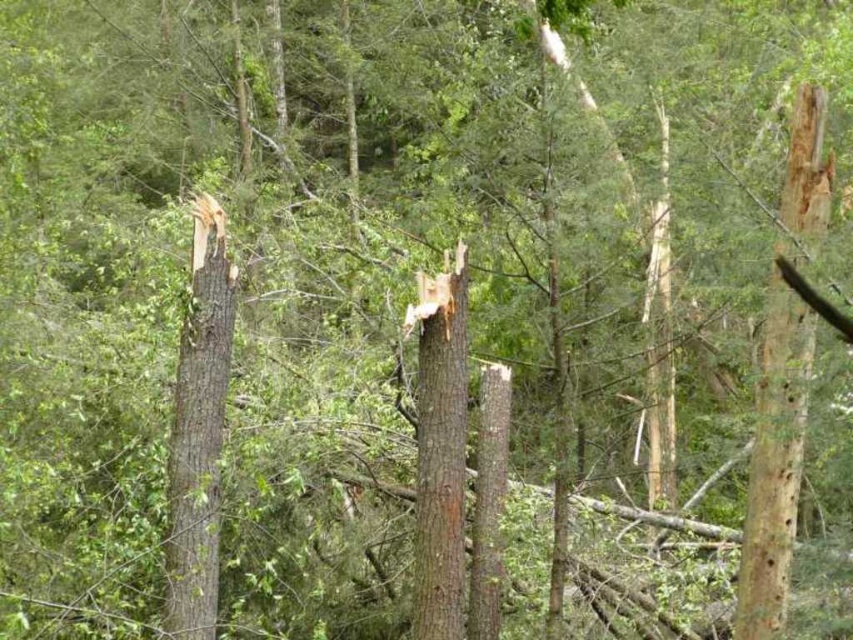
Question: Which point appears closest to the camera in this image?

Choices:
 (A) (430, 438)
 (B) (193, 545)

Answer: (B)

Question: In this image, where is smooth brown tree trunk at left located relative to brown rough tree trunk at center?

Choices:
 (A) left
 (B) right

Answer: (A)

Question: Can you confirm if smooth brown tree trunk at left is smaller than brown rough tree trunk at center?

Choices:
 (A) yes
 (B) no

Answer: (B)

Question: Among these points, which one is farthest from the camera?

Choices:
 (A) (225, 321)
 (B) (412, 634)

Answer: (B)

Question: Can you confirm if smooth brown tree trunk at left is positioned below brown rough tree trunk at center?

Choices:
 (A) yes
 (B) no

Answer: (B)